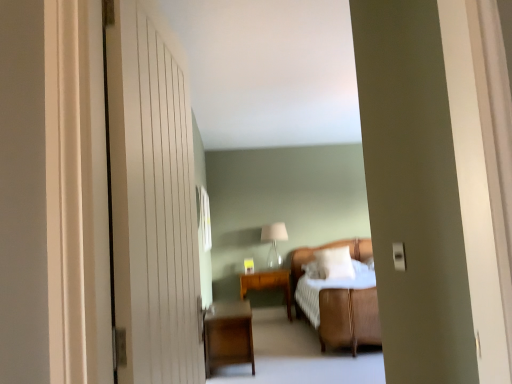
Question: Do you think dark wood nightstand at lower left is within wooden side table at center, or outside of it?

Choices:
 (A) outside
 (B) inside

Answer: (A)

Question: From a real-world perspective, is dark wood nightstand at lower left physically located above or below wooden side table at center?

Choices:
 (A) below
 (B) above

Answer: (A)

Question: Estimate the real-world distances between objects in this image. Which object is closer to the translucent glass table lamp at center?

Choices:
 (A) white wooden door at left
 (B) dark wood nightstand at lower left
 (C) clear glass window at center
 (D) white textured bed at center
 (E) wooden side table at center

Answer: (E)

Question: Considering the real-world distances, which object is closest to the wooden side table at center?

Choices:
 (A) white textured bed at center
 (B) white wooden door at left
 (C) dark wood nightstand at lower left
 (D) clear glass window at center
 (E) translucent glass table lamp at center

Answer: (E)